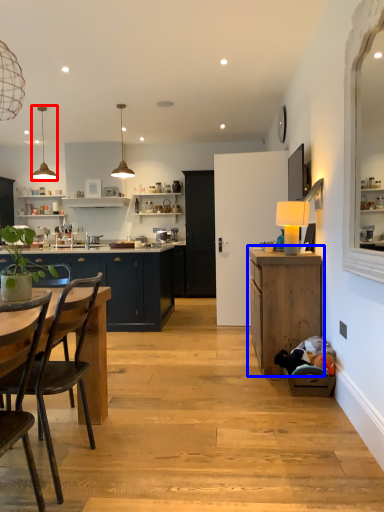
Question: Which of the following is the farthest to the observer, lamp (highlighted by a red box) or cabinetry (highlighted by a blue box)?

Choices:
 (A) lamp
 (B) cabinetry

Answer: (A)